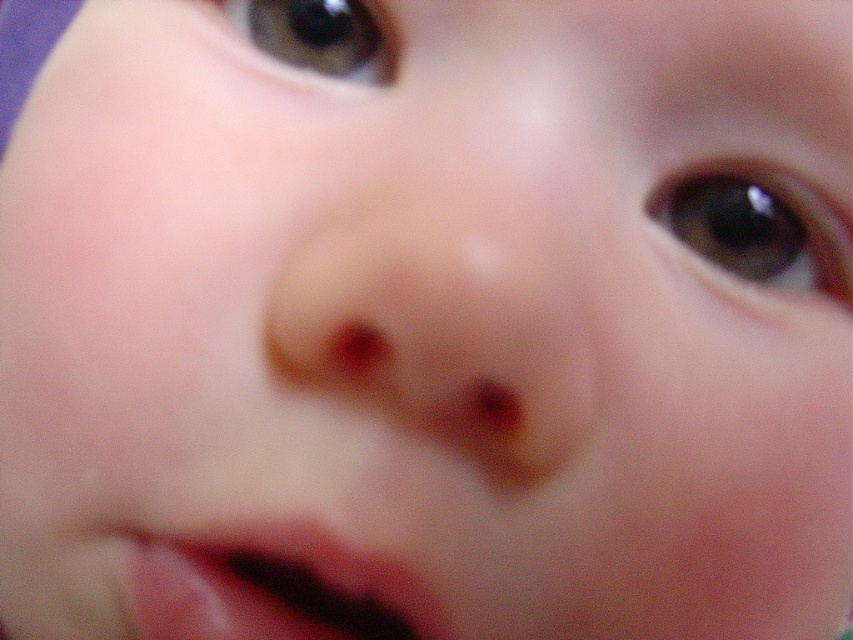
You are a pediatrician examining a baby. You notice the pink smooth lips at lower center and the brown glossy eye at upper right. Which of these two features is larger in size?

The pink smooth lips at lower center are larger than the brown glossy eye at upper right.

You are a photographer taking a closeup of a baby. You want to focus on the point at point [276,598]. The camera is set to focus at 9 inches. Will the focus be sharp on that point?

The distance of point [276,598] from camera is 8.87 inches, which is very close to the camera focus setting of 9 inches. The focus should be sharp on that point.

In the scene shown: You are a photographer adjusting the focus on a camera lens. You need to ensure both the brown glossy eye at upper right and the brown glossy eye at upper left are in focus. Which eye should you adjust the focus towards first if you want to start with the one closer to the center of the image?

The brown glossy eye at upper left should be focused on first because it is closer to the center of the image than the brown glossy eye at upper right.